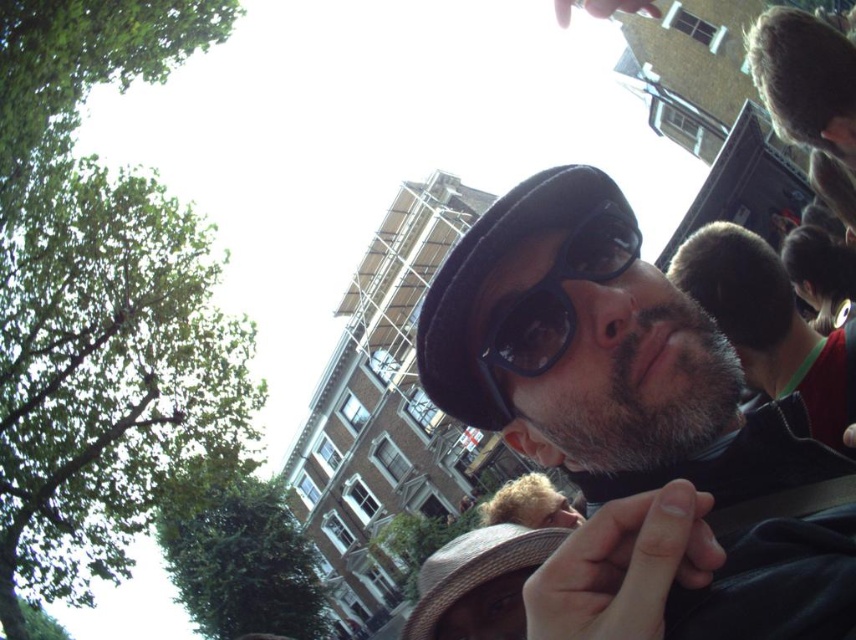
You are a photographer trying to capture a clear shot of the blonde hair at center and the gray fuzzy hat at upper right. Which object should you focus on first to ensure both are in focus?

The gray fuzzy hat at upper right is closer to the viewer than the blonde hair at center, so you should focus on the gray fuzzy hat at upper right first to ensure both are in focus.

You are a photographer trying to capture a portrait of the person in the scene. You notice the black plastic goggles at center and the blonde hair at center. Which object should you adjust to ensure the goggles are centered in the frame?

The black plastic goggles at center is positioned on the left side of blonde hair at center, so you should move the camera to the left to center the goggles.

You are a photographer trying to capture a portrait of the person in the scene. You need to ensure that both the black plastic goggles at center and the blonde hair at center are in focus. Given that your camera can only focus on objects within a 20 meter range, will both objects be in focus?

The black plastic goggles at center is 22.49 meters from blonde hair at center. Since the distance between them exceeds the camera focus range of 20 meters, the camera cannot keep both in focus simultaneously.